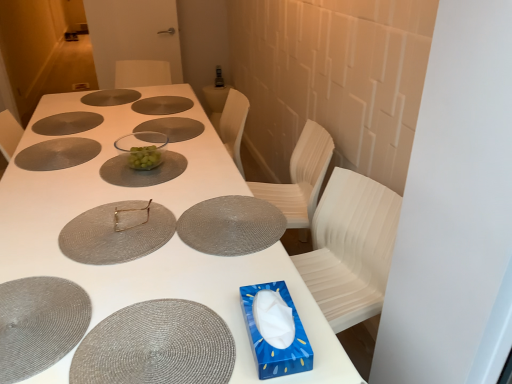
Image resolution: width=512 pixels, height=384 pixels. Find the location of `free area in between matte gray placemat at center, arranged as the second glass plate when viewed from the front, and transparent glass bowl at center, acting as the sixth glass plate starting from the back`. free area in between matte gray placemat at center, arranged as the second glass plate when viewed from the front, and transparent glass bowl at center, acting as the sixth glass plate starting from the back is located at coordinates (129, 189).